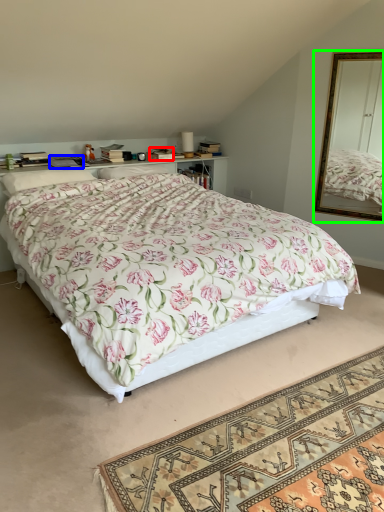
Question: Based on their relative distances, which object is farther from box (highlighted by a red box)? Choose from book (highlighted by a blue box) and mirror (highlighted by a green box).

Choices:
 (A) book
 (B) mirror

Answer: (B)